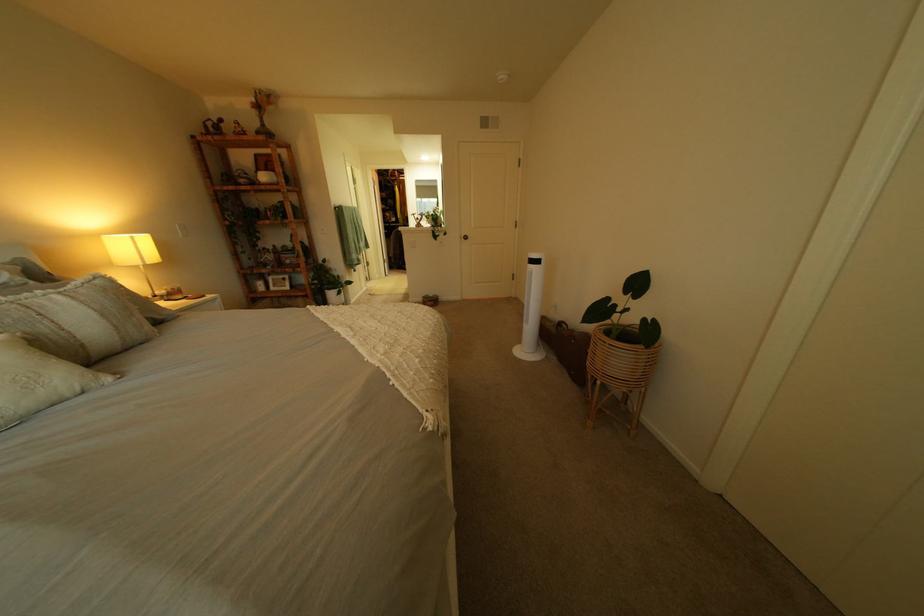
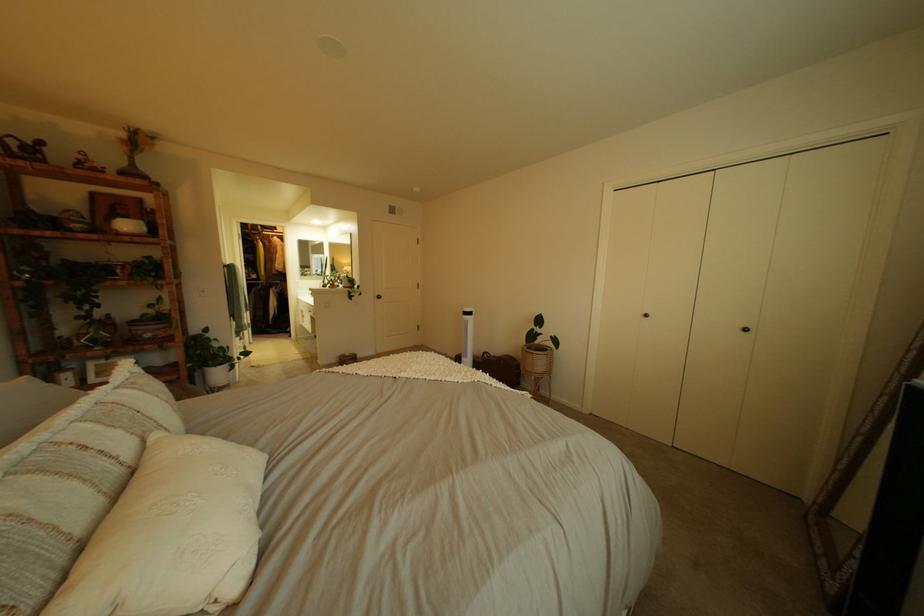
Find the pixel in the second image that matches point 430,331 in the first image.

(468, 365)